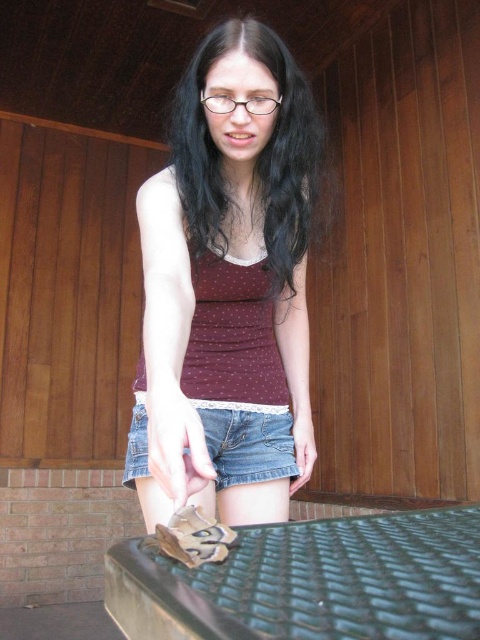
You are a photographer setting up a tripod to take a portrait of the person in the scene. The tripod has a minimum focus distance of 34 inches. Will you be able to focus on the denim shorts at center?

The denim shorts at center is 33.88 inches from viewer, which is less than the tripod minimum focus distance of 34 inches. Therefore, the tripod cannot focus on the denim shorts at center.

Based on the scene description, which object is higher in position between the black wavy hair at center and the denim shorts at center?

The black wavy hair at center is taller than the denim shorts at center.